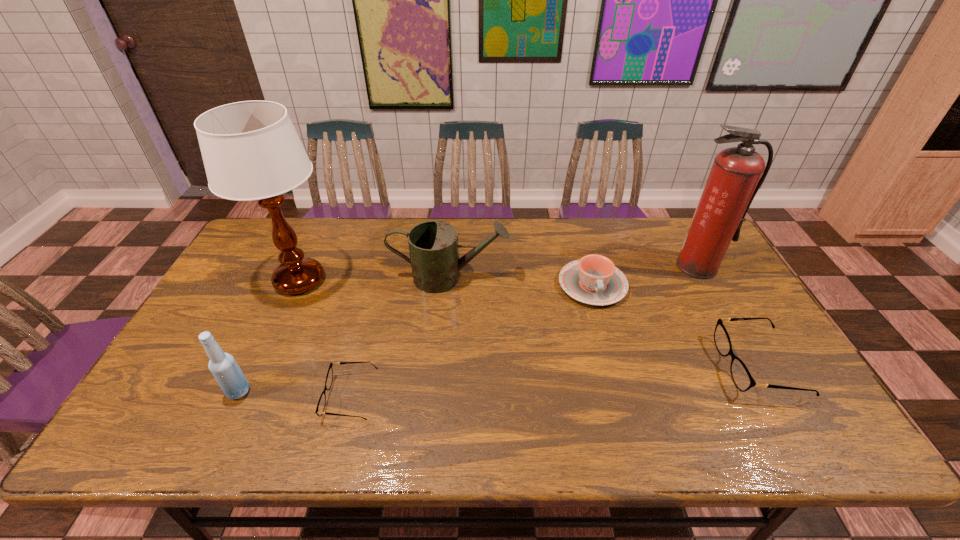
The width and height of the screenshot is (960, 540). Find the location of `vacant space at the far edge of the desktop`. vacant space at the far edge of the desktop is located at coordinates (639, 226).

The image size is (960, 540). In the image, there is a desktop. Find the location of `free region at the left edge`. free region at the left edge is located at coordinates (231, 294).

Image resolution: width=960 pixels, height=540 pixels. In the image, there is a desktop. In order to click on vacant space at the right edge in this screenshot , I will do `click(722, 289)`.

Image resolution: width=960 pixels, height=540 pixels. I want to click on vacant space at the far right corner, so click(671, 245).

This screenshot has width=960, height=540. Identify the location of free space between the bottle and the fire extinguisher. (468, 329).

Where is `unoccupied area between the table lamp and the bottle`? This screenshot has height=540, width=960. unoccupied area between the table lamp and the bottle is located at coordinates (269, 336).

Identify the location of vacant space that's between the right spectacles and the fire extinguisher. Image resolution: width=960 pixels, height=540 pixels. (728, 316).

Image resolution: width=960 pixels, height=540 pixels. Find the location of `blank region between the watering can and the chinaware`. blank region between the watering can and the chinaware is located at coordinates (520, 281).

The width and height of the screenshot is (960, 540). In order to click on unoccupied area between the sixth tallest object and the fire extinguisher in this screenshot , I will do `click(728, 316)`.

Where is `free space between the sixth tallest object and the watering can`? free space between the sixth tallest object and the watering can is located at coordinates (604, 321).